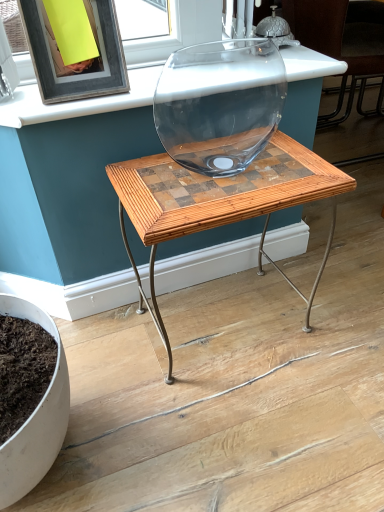
Find the location of a particular element. The width and height of the screenshot is (384, 512). vacant space positioned to the left of wooden mosaic table at center is located at coordinates (116, 345).